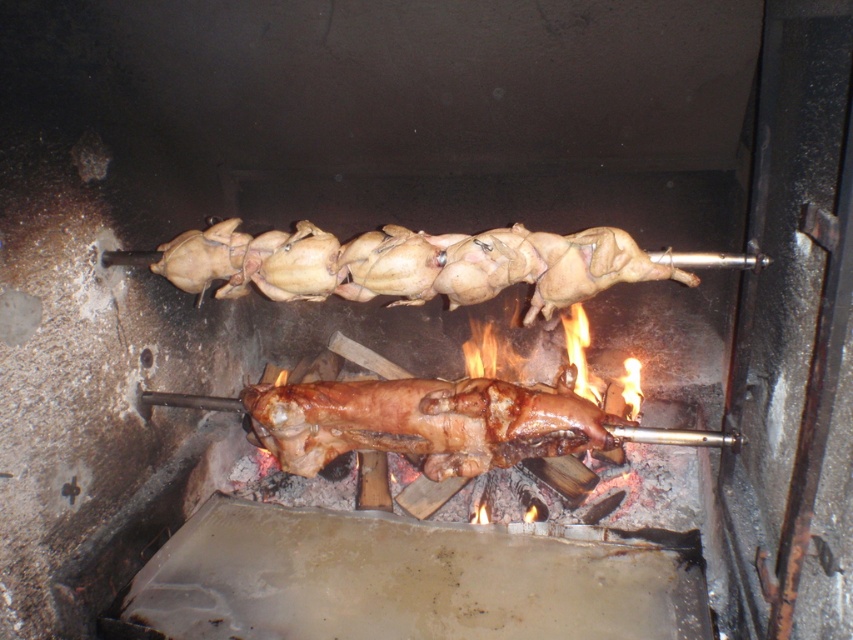
Which is in front, point (271, 273) or point (431, 385)?

Point (271, 273) is in front.

Does point (281, 237) come farther from viewer compared to point (572, 420)?

That is True.

The width and height of the screenshot is (853, 640). I want to click on golden brown chicken at center, so click(x=409, y=264).